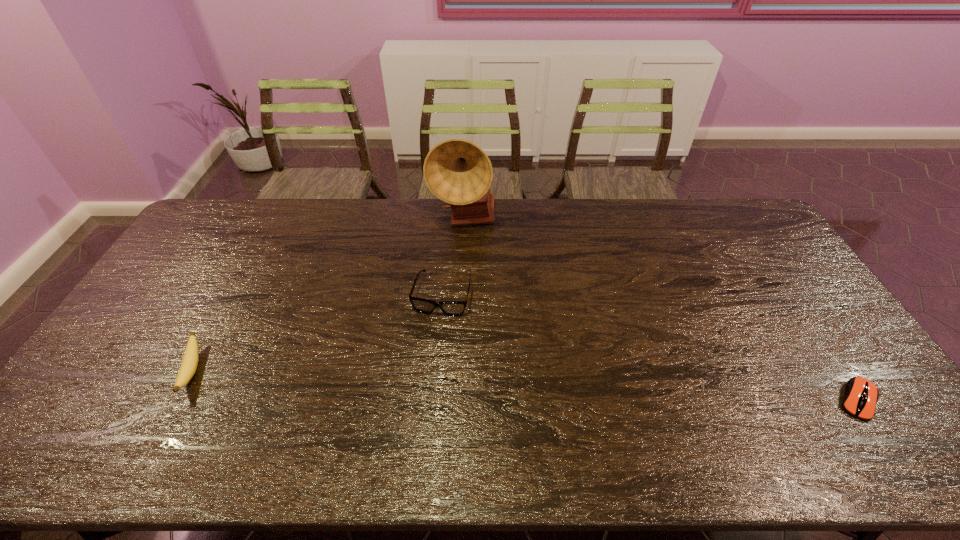
Locate an element on the screen. The height and width of the screenshot is (540, 960). free point located 0.270m on the front-facing side of the third nearest object is located at coordinates (416, 398).

I want to click on vacant space located 0.130m on the front-facing side of the third nearest object, so click(x=427, y=353).

The height and width of the screenshot is (540, 960). Find the location of `vacant space located on the horn of the farthest object`. vacant space located on the horn of the farthest object is located at coordinates (521, 299).

Locate an element on the screen. This screenshot has height=540, width=960. blank space located on the horn of the farthest object is located at coordinates (488, 254).

Find the location of a particular element. This screenshot has width=960, height=540. free spot located 0.050m on the horn of the farthest object is located at coordinates [x=484, y=249].

This screenshot has width=960, height=540. I want to click on object at the far edge, so click(x=457, y=171).

Identify the location of banana at the near edge. (188, 367).

This screenshot has width=960, height=540. What are the coordinates of `computer mouse at the near edge` in the screenshot? It's located at (861, 395).

You are a GUI agent. You are given a task and a screenshot of the screen. Output one action in this format:
    pyautogui.click(x=<x>, y=<y>)
    Task: Click on the object that is at the right edge
    The width and height of the screenshot is (960, 540).
    Given the screenshot: What is the action you would take?
    [861, 395]

Find the location of a particular element. This screenshot has height=540, width=960. object that is positioned at the near right corner is located at coordinates (861, 395).